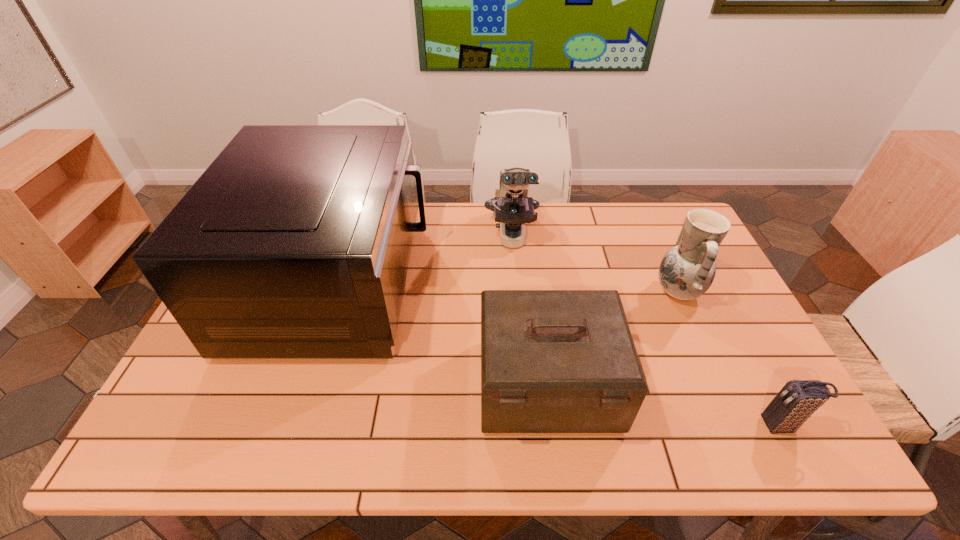
The width and height of the screenshot is (960, 540). Identify the location of vacant region between the first-aid kit and the microwave_oven. (443, 334).

At what (x,y) coordinates should I click in order to perform the action: click on vacant area between the microscope and the pottery. Please return your answer as a coordinate pair (x, y). Looking at the image, I should click on (595, 265).

Locate an element on the screen. The width and height of the screenshot is (960, 540). vacant area that lies between the first-aid kit and the leftmost object is located at coordinates (443, 334).

This screenshot has width=960, height=540. Identify the location of vacant space in between the first-aid kit and the leftmost object. (443, 334).

Find the location of `unoccupied area between the microscope and the pottery`. unoccupied area between the microscope and the pottery is located at coordinates (595, 265).

The image size is (960, 540). In order to click on empty space between the microscope and the pottery in this screenshot , I will do `click(595, 265)`.

Select which object appears as the second closest to the shortest object. Please provide its 2D coordinates. Your answer should be formatted as a tuple, i.e. [(x, y)], where the tuple contains the x and y coordinates of a point satisfying the conditions above.

[(686, 272)]

Where is `object that is the third nearest to the leftmost object`? object that is the third nearest to the leftmost object is located at coordinates (686, 272).

Identify the location of free space in the image that satisfies the following two spatial constraints: 1. through the eyepieces of the microscope; 2. on the front-facing side of the microwave_oven. This screenshot has height=540, width=960. (516, 283).

The height and width of the screenshot is (540, 960). Find the location of `vacant space that satisfies the following two spatial constraints: 1. on the front-facing side of the leftmost object; 2. on the left side of the first-aid kit`. vacant space that satisfies the following two spatial constraints: 1. on the front-facing side of the leftmost object; 2. on the left side of the first-aid kit is located at coordinates (304, 385).